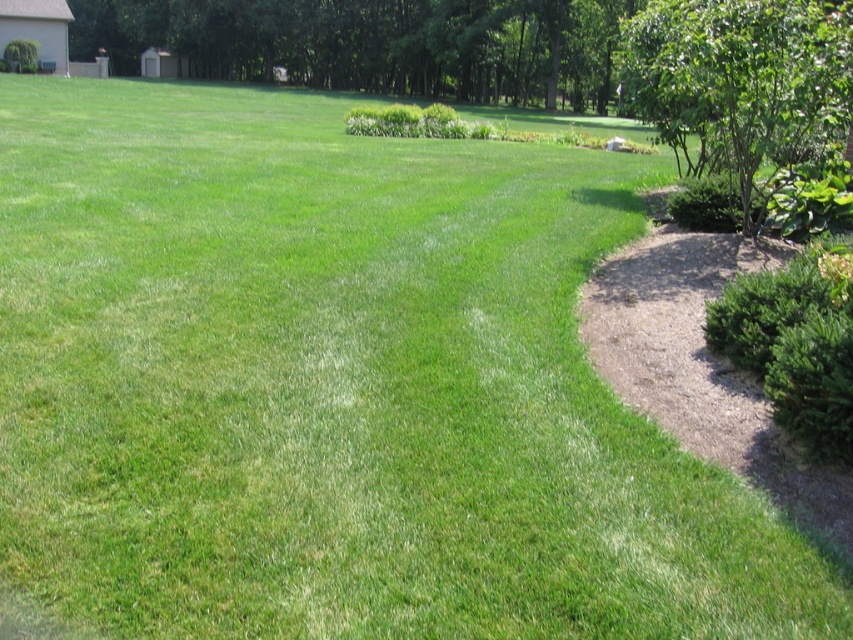
Is point (758, 72) less distant than point (381, 134)?

Yes, it is in front of point (381, 134).

Is green leafy tree at upper right thinner than green leafy bush at center?

No.

I want to click on green leafy tree at upper right, so click(x=741, y=81).

The width and height of the screenshot is (853, 640). Identify the location of green leafy tree at upper right. (741, 81).

Does green leafy tree at upper center appear on the right side of green leafy bush at center?

No, green leafy tree at upper center is not to the right of green leafy bush at center.

From the picture: Does green leafy tree at upper center appear under green leafy bush at center?

Incorrect, green leafy tree at upper center is not positioned below green leafy bush at center.

Is point (187, 68) in front of point (456, 115)?

No.

You are a GUI agent. You are given a task and a screenshot of the screen. Output one action in this format:
    pyautogui.click(x=<x>, y=<y>)
    Task: Click on the green leafy tree at upper center
    This screenshot has height=640, width=853.
    Given the screenshot: What is the action you would take?
    pyautogui.click(x=374, y=44)

Can you confirm if green textured bush at right is smaller than green leafy bush at center?

Indeed, green textured bush at right has a smaller size compared to green leafy bush at center.

Is point (708, 323) behind point (386, 113)?

That is False.

Who is more distant from viewer, (x=724, y=340) or (x=415, y=106)?

Positioned behind is point (x=415, y=106).

This screenshot has width=853, height=640. I want to click on green textured bush at right, so click(793, 342).